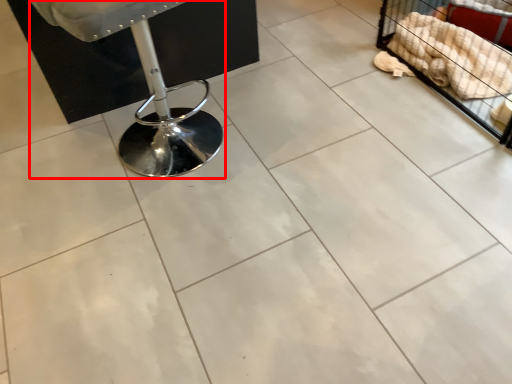
Question: From the image's perspective, considering the relative positions of swivel chair (annotated by the red box) and furniture in the image provided, where is swivel chair (annotated by the red box) located with respect to the staircase?

Choices:
 (A) above
 (B) below

Answer: (B)